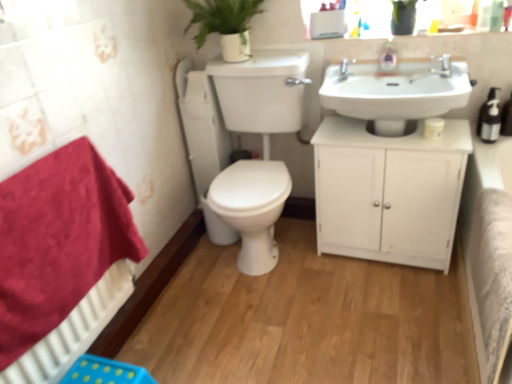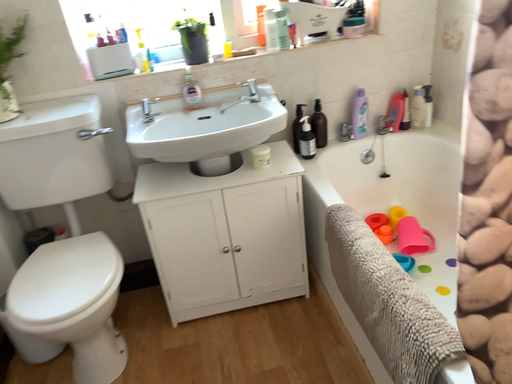
Question: Which way did the camera rotate in the video?

Choices:
 (A) rotated downward
 (B) rotated upward

Answer: (B)